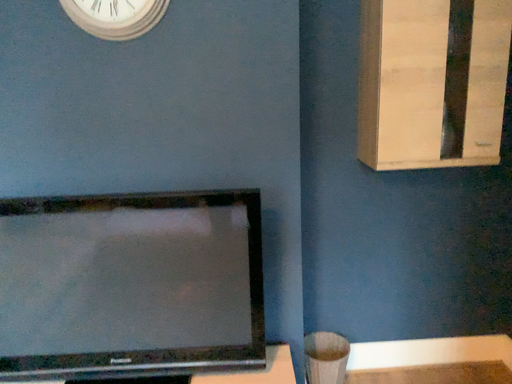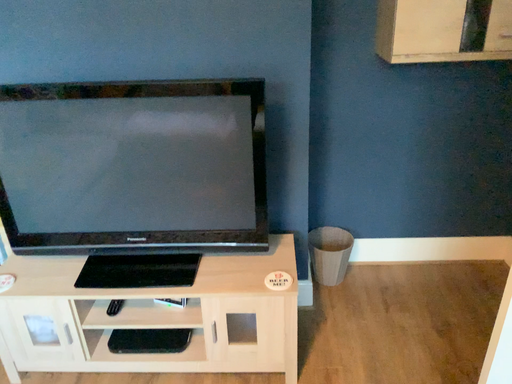
Question: Which way did the camera rotate in the video?

Choices:
 (A) rotated upward
 (B) rotated downward

Answer: (B)